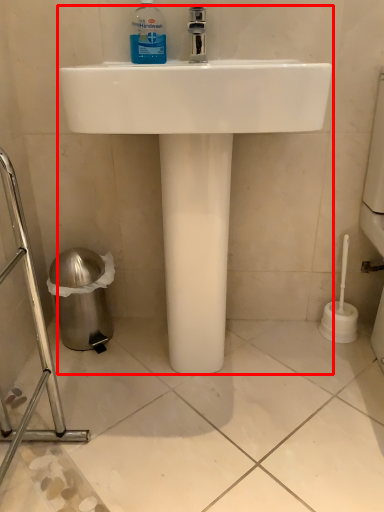
Question: From the image's perspective, considering the relative positions of sink (annotated by the red box) and cleaning product in the image provided, where is sink (annotated by the red box) located with respect to the staircase?

Choices:
 (A) below
 (B) above

Answer: (A)